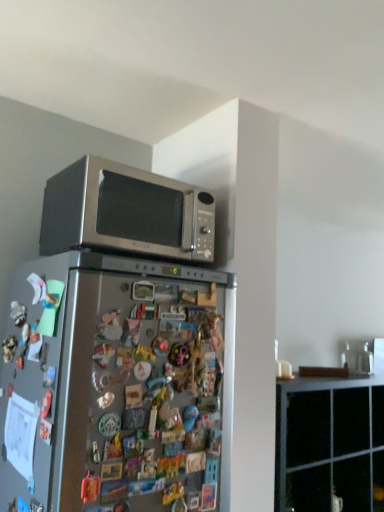
Question: From the image's perspective, is black matte cabinet at upper right over satin silver microwave at upper center?

Choices:
 (A) yes
 (B) no

Answer: (B)

Question: Is black matte cabinet at upper right in front of satin silver microwave at upper center?

Choices:
 (A) yes
 (B) no

Answer: (B)

Question: Does black matte cabinet at upper right have a greater height compared to satin silver microwave at upper center?

Choices:
 (A) yes
 (B) no

Answer: (A)

Question: Does black matte cabinet at upper right have a larger size compared to satin silver microwave at upper center?

Choices:
 (A) yes
 (B) no

Answer: (A)

Question: Would you say black matte cabinet at upper right contains satin silver microwave at upper center?

Choices:
 (A) no
 (B) yes

Answer: (A)

Question: Visually, is satin silver microwave at upper center positioned to the left or to the right of satin silver refrigerator at center?

Choices:
 (A) right
 (B) left

Answer: (A)

Question: Looking at their shapes, would you say satin silver microwave at upper center is wider or thinner than satin silver refrigerator at center?

Choices:
 (A) wide
 (B) thin

Answer: (B)

Question: Is satin silver microwave at upper center taller or shorter than satin silver refrigerator at center?

Choices:
 (A) tall
 (B) short

Answer: (B)

Question: Does point (165, 226) appear closer or farther from the camera than point (150, 423)?

Choices:
 (A) closer
 (B) farther

Answer: (B)

Question: Looking at the image, does black matte cabinet at upper right seem bigger or smaller compared to satin silver microwave at upper center?

Choices:
 (A) big
 (B) small

Answer: (A)

Question: Considering their positions, is black matte cabinet at upper right located in front of or behind satin silver microwave at upper center?

Choices:
 (A) front
 (B) behind

Answer: (B)

Question: Choose the correct answer: Is black matte cabinet at upper right inside satin silver microwave at upper center or outside it?

Choices:
 (A) outside
 (B) inside

Answer: (A)

Question: From their relative heights in the image, would you say black matte cabinet at upper right is taller or shorter than satin silver microwave at upper center?

Choices:
 (A) tall
 (B) short

Answer: (A)

Question: From the image's perspective, is black matte cabinet at upper right positioned above or below satin silver refrigerator at center?

Choices:
 (A) below
 (B) above

Answer: (A)

Question: Considering the positions of point (331, 378) and point (82, 322), is point (331, 378) closer or farther from the camera than point (82, 322)?

Choices:
 (A) farther
 (B) closer

Answer: (A)